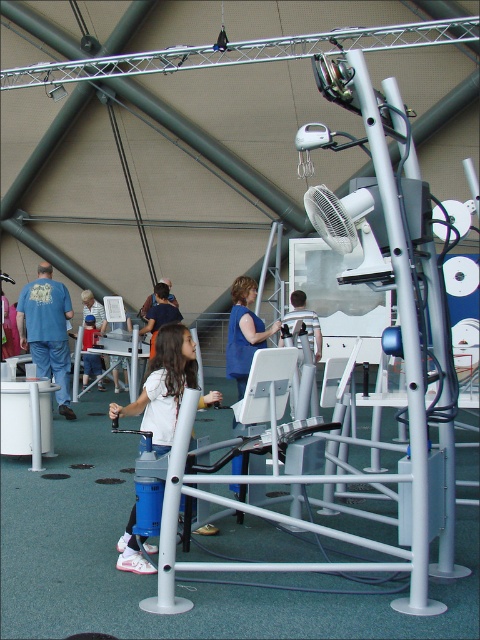
Measure the distance from white matte shirt at center to blue fabric shirt at center.

white matte shirt at center and blue fabric shirt at center are 5.54 feet apart.

Can you confirm if white matte shirt at center is smaller than blue fabric shirt at center?

Yes, white matte shirt at center is smaller than blue fabric shirt at center.

At what (x,y) coordinates should I click in order to perform the action: click on white matte shirt at center. Please return your answer as a coordinate pair (x, y). The height and width of the screenshot is (640, 480). Looking at the image, I should click on (164, 385).

Which is below, white matte shirt at center or blue denim jeans at left?

white matte shirt at center is lower down.

Between point (153, 572) and point (66, 372), which one is positioned behind?

The point (66, 372) is behind.

Where is `white matte shirt at center`? white matte shirt at center is located at coordinates (164, 385).

Between point (46, 273) and point (252, 333), which one is positioned in front?

Point (252, 333) is in front.

Is blue denim jeans at left wider than blue fabric shirt at center?

Indeed, blue denim jeans at left has a greater width compared to blue fabric shirt at center.

This screenshot has height=640, width=480. I want to click on blue denim jeans at left, so click(47, 330).